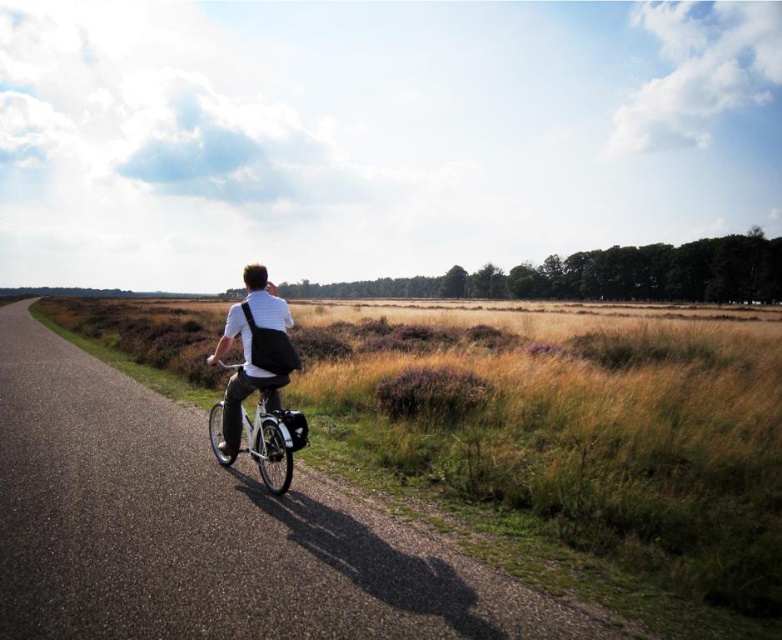
Question: Is matte black backpack at center wider than white metallic bicycle at center?

Choices:
 (A) yes
 (B) no

Answer: (B)

Question: Which point appears farthest from the camera in this image?

Choices:
 (A) [571, 637]
 (B) [223, 400]
 (C) [293, 428]

Answer: (B)

Question: Is matte black backpack at center further to the viewer compared to white metallic bicycle at center?

Choices:
 (A) no
 (B) yes

Answer: (B)

Question: Does matte black backpack at center have a greater width compared to white metallic bicycle at center?

Choices:
 (A) no
 (B) yes

Answer: (A)

Question: Which of these objects is positioned farthest from the white metallic bicycle at center?

Choices:
 (A) asphalt road at center
 (B) matte black backpack at center

Answer: (A)

Question: Which object is the farthest from the matte black backpack at center?

Choices:
 (A) white metallic bicycle at center
 (B) asphalt road at center

Answer: (B)